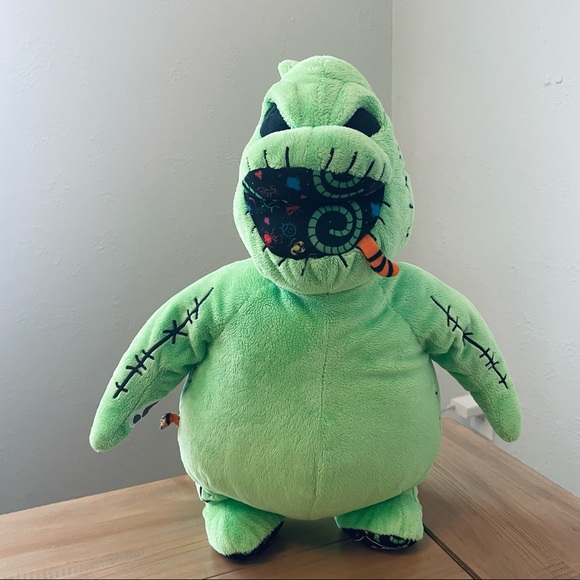
This screenshot has height=580, width=580. Identify the location of front table. (371, 566).